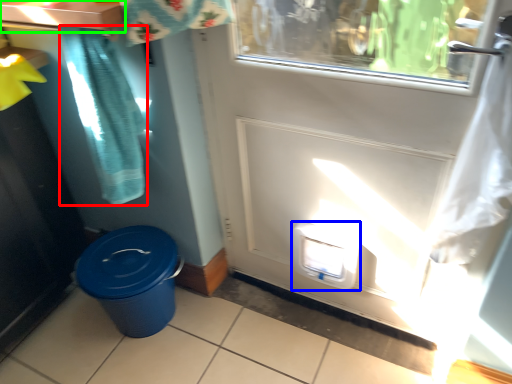
Question: Estimate the real-world distances between objects in this image. Which object is farther from shower curtain (highlighted by a red box), water cooler (highlighted by a blue box) or counter top (highlighted by a green box)?

Choices:
 (A) water cooler
 (B) counter top

Answer: (A)